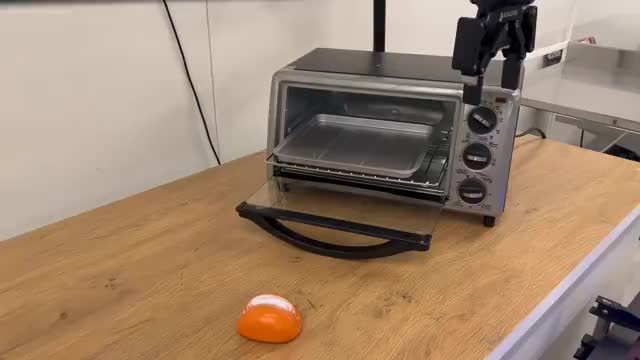
Locate an element on the screen. This screenshot has height=360, width=640. wooden countertops is located at coordinates (468, 313).